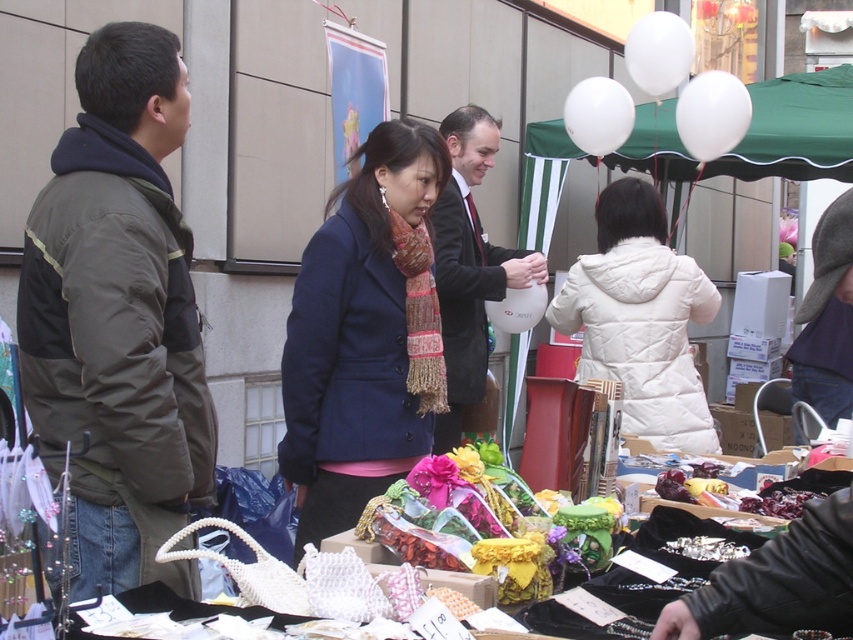
Consider the image. You are standing at the market and see two points marked on the ground. The first point is at coordinate point (x=114, y=404) and the second is at point (x=407, y=376). Which point is closer to you?

Point (x=114, y=404) is in front of point (x=407, y=376), so it is closer to you.

You are standing at the point marked as point [136,429] in the market scene. You want to reach the nearest exit, which is located 10 feet behind you. Can you safely walk backward to the exit without hitting any obstacles?

The distance between point [136,429] and the viewer is 8.41 feet. Since the exit is 10 feet behind you, you have enough space to walk backward safely without obstacles.

You are standing at the center of the market and see the point marked at coordinates (119, 317). What object is located at that point?

The point at (119, 317) marks the dark green jacket at left.